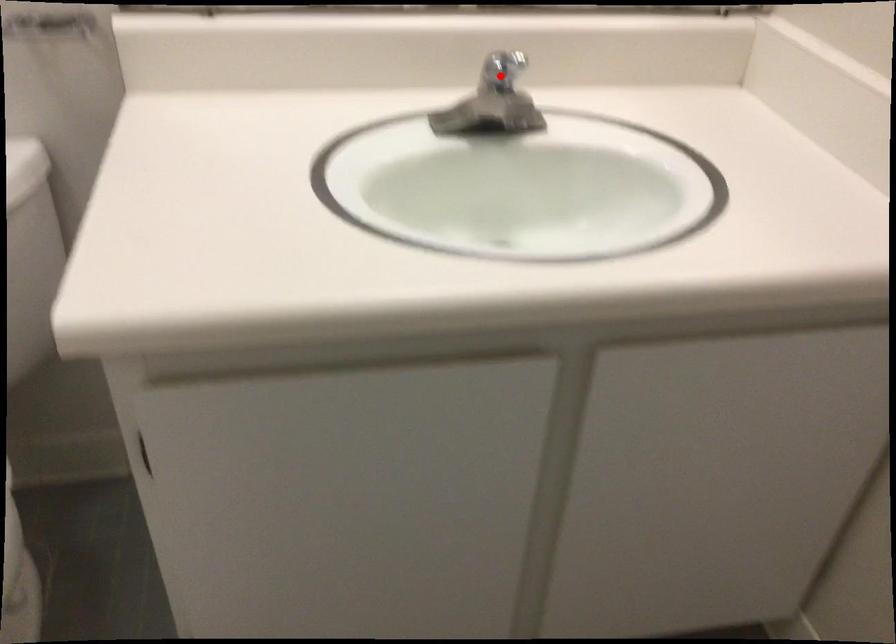
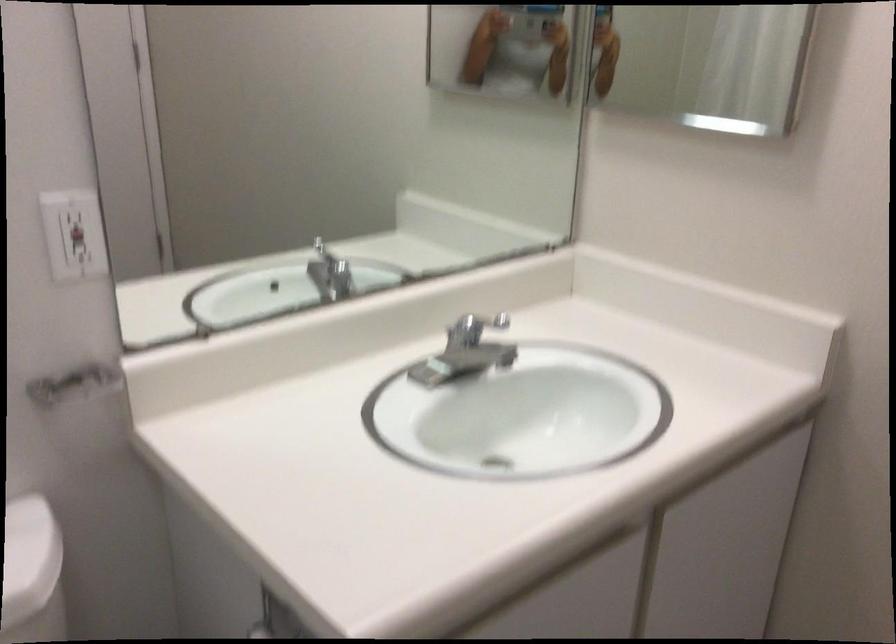
Question: A red point is marked in image1. In image2, is the corresponding 3D point closer to the camera or farther? Reply with the corresponding letter.

Choices:
 (A) The corresponding 3D point is closer.
 (B) The corresponding 3D point is farther.

Answer: (B)